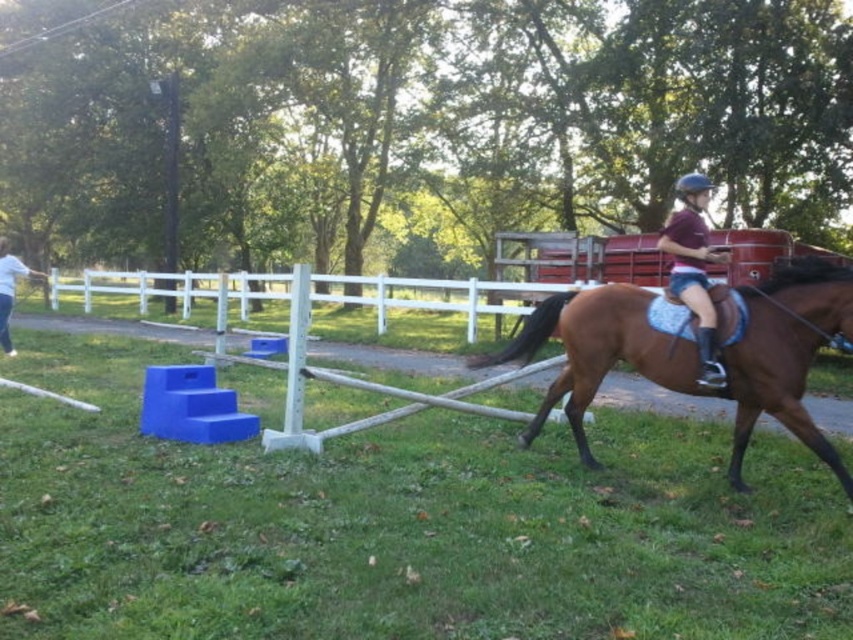
Question: Estimate the real-world distances between objects in this image. Which object is farther from the white cotton shirt at left?

Choices:
 (A) maroon jersey at center
 (B) brown glossy horse at right

Answer: (A)

Question: Among these points, which one is farthest from the camera?

Choices:
 (A) (247, 282)
 (B) (622, 320)

Answer: (A)

Question: Which point is farther to the camera?

Choices:
 (A) maroon jersey at center
 (B) white cotton shirt at left
 (C) brown glossy horse at right
 (D) white vinyl fence at center

Answer: (B)

Question: Is brown glossy horse at right positioned in front of maroon jersey at center?

Choices:
 (A) no
 (B) yes

Answer: (B)

Question: Does white vinyl fence at center have a lesser width compared to maroon jersey at center?

Choices:
 (A) no
 (B) yes

Answer: (A)

Question: Is brown glossy horse at right positioned at the back of white vinyl fence at center?

Choices:
 (A) yes
 (B) no

Answer: (B)